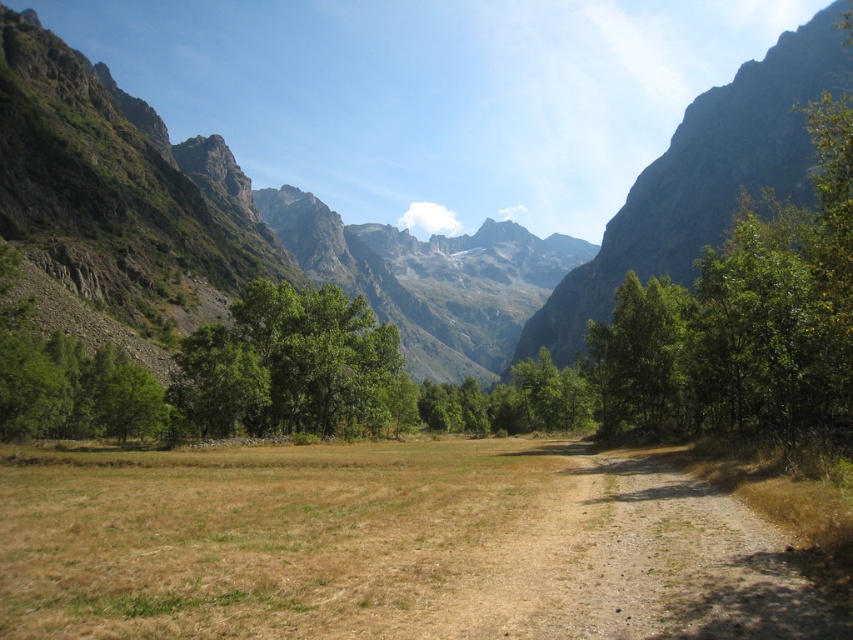
Which is more to the right, rocky gray mountain at center or rugged rock mountain at upper right?

rugged rock mountain at upper right is more to the right.

Does rocky gray mountain at center appear on the right side of rugged rock mountain at upper right?

No, rocky gray mountain at center is not to the right of rugged rock mountain at upper right.

Image resolution: width=853 pixels, height=640 pixels. I want to click on rocky gray mountain at center, so click(x=338, y=214).